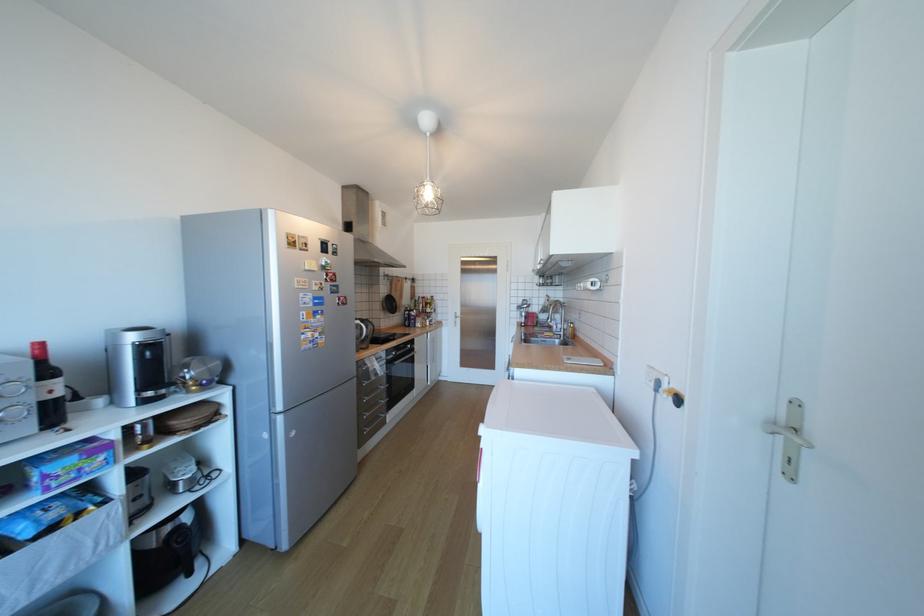
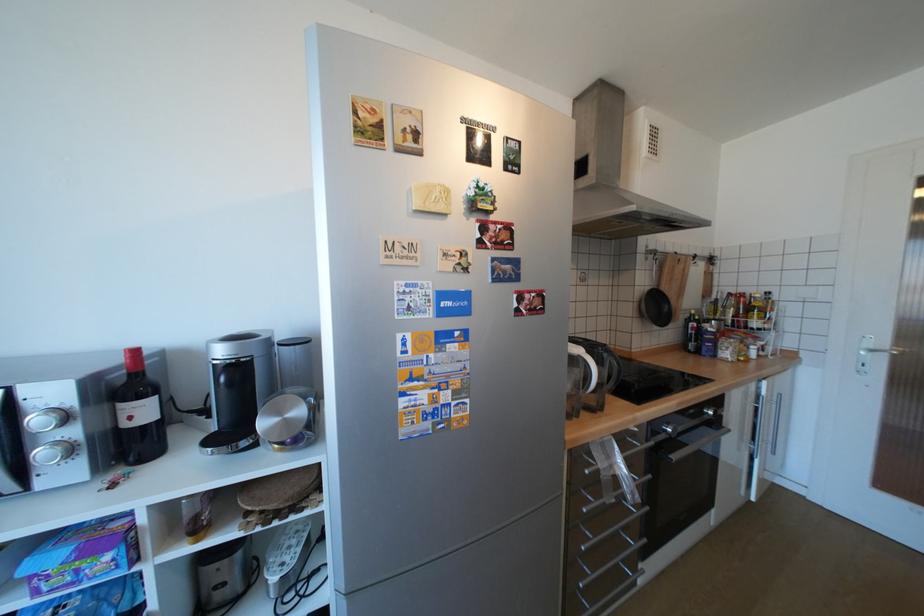
Find the pixel in the second image that matches point (402, 294) in the first image.

(672, 290)